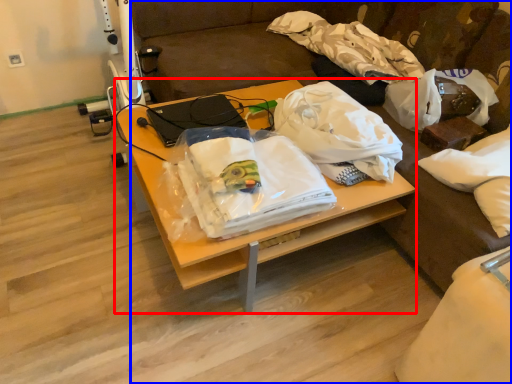
Question: Among these objects, which one is nearest to the camera, desk (highlighted by a red box) or studio couch (highlighted by a blue box)?

Choices:
 (A) desk
 (B) studio couch

Answer: (B)